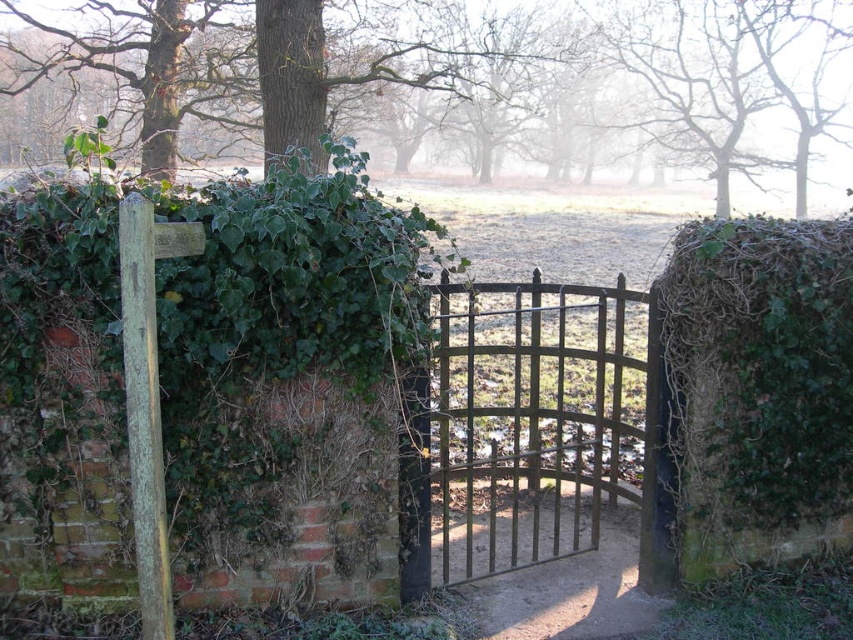
You are standing in front of the gate and want to place a small decoration exactly at the center of the green ivy at right. What are the coordinates where you should place it?

The coordinates for the center of the green ivy at right are at point (x=753, y=387).

You are standing in front of the scene and want to take a photo of the brown metal gate at center and the green leafy tree at upper left. Which object appears taller in the photo?

The green leafy tree at upper left appears taller than the brown metal gate at center in the photo because the brown metal gate at center has a lesser height compared to green leafy tree at upper left.